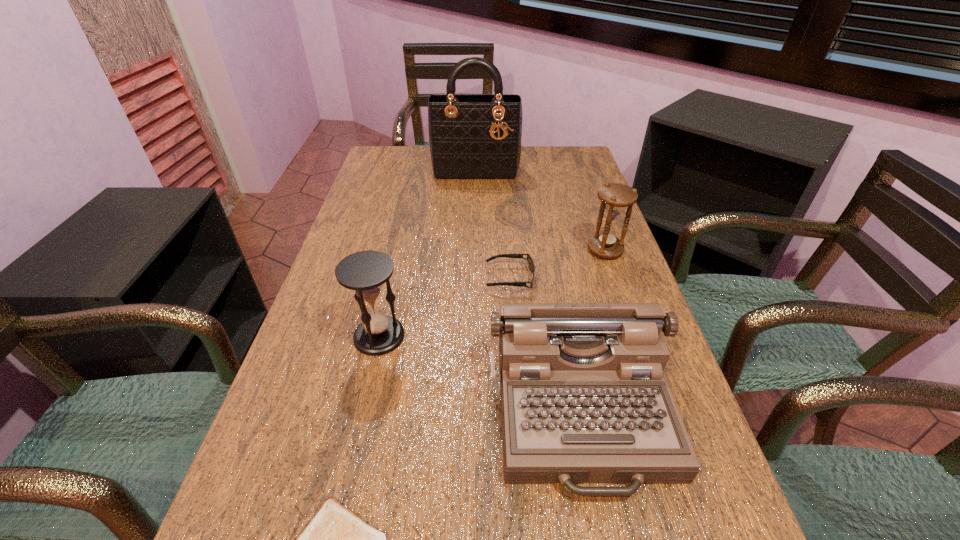
Point out which object is positioned as the fifth nearest to the shortest object. Please provide its 2D coordinates. Your answer should be formatted as a tuple, i.e. [(x, y)], where the tuple contains the x and y coordinates of a point satisfying the conditions above.

[(474, 137)]

Where is `free space that satisfies the following two spatial constraints: 1. at the front of the tallest object with visible charms; 2. on the right side of the fifth nearest object`? The image size is (960, 540). free space that satisfies the following two spatial constraints: 1. at the front of the tallest object with visible charms; 2. on the right side of the fifth nearest object is located at coordinates (474, 250).

I want to click on vacant point that satisfies the following two spatial constraints: 1. at the front of the farther hourglass with visible charms; 2. on the right side of the tallest object, so click(x=474, y=250).